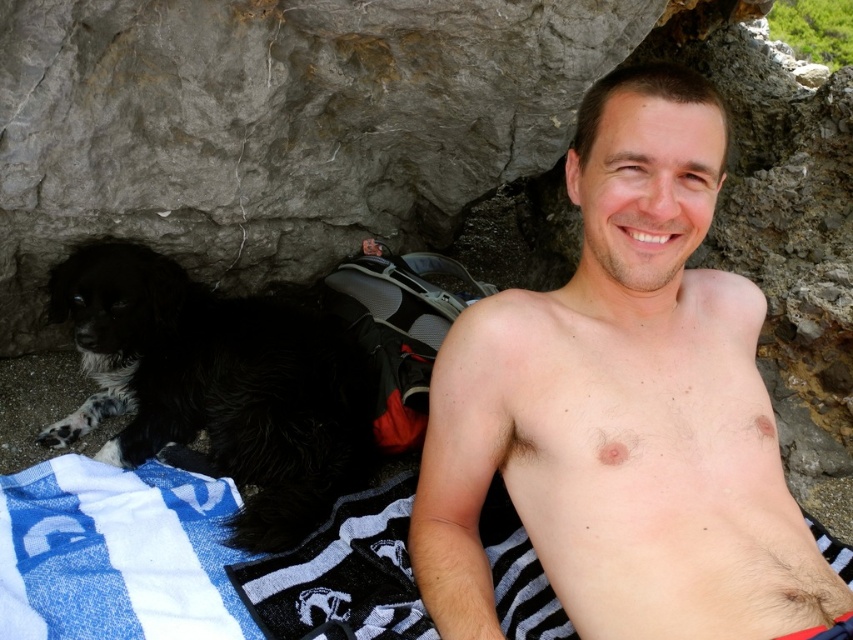
Question: Does hairless skin at center have a greater width compared to black fluffy dog at left?

Choices:
 (A) yes
 (B) no

Answer: (B)

Question: Which object appears closest to the camera in this image?

Choices:
 (A) black fluffy dog at left
 (B) hairless skin at center

Answer: (B)

Question: Which point is closer to the camera?

Choices:
 (A) (273, 515)
 (B) (723, 534)

Answer: (B)

Question: Does hairless skin at center have a smaller size compared to black fluffy dog at left?

Choices:
 (A) yes
 (B) no

Answer: (B)

Question: Is hairless skin at center to the right of black fluffy dog at left from the viewer's perspective?

Choices:
 (A) no
 (B) yes

Answer: (B)